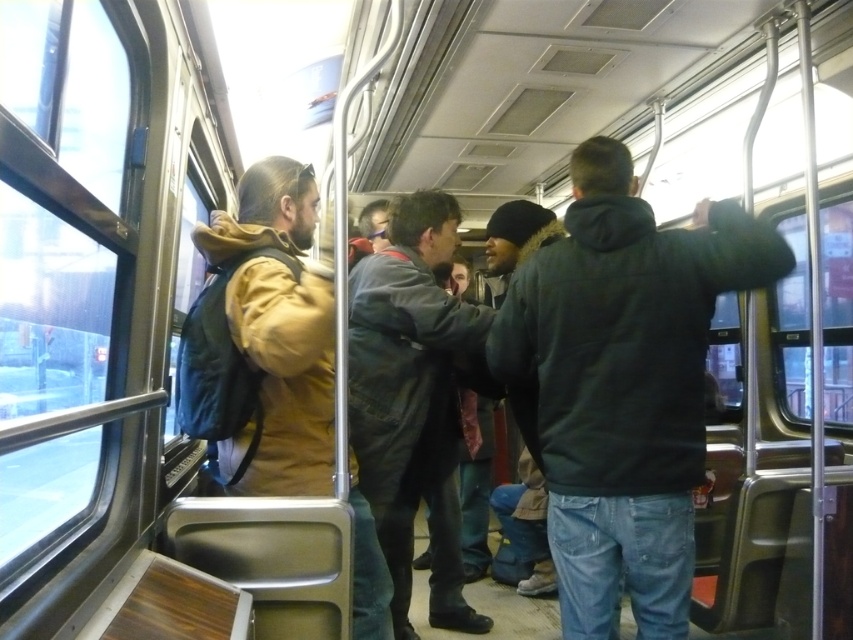
You are a passenger on a crowded bus and need to reach the exit door, which is located on the right side of the vehicle. There is a dark gray hoodie at right and a brown leather jacket at left in your way. Which direction should you move around to get to the exit?

The dark gray hoodie at right is positioned on the right side of brown leather jacket at left. To reach the exit door on the right, you should move around the right side of the dark gray hoodie at right.

What are the coordinates of the dark gray leather jacket at center?

The dark gray leather jacket at center is located at coordinates point (413, 397).

You are a passenger on a crowded transit vehicle and need to sit down. There are two dark gray jackets at center. Which one has a wider jacket? Please choose between the dark gray leather jacket at center and the dark gray jacket at center.

The dark gray leather jacket at center is wider than the dark gray jacket at center according to the description.